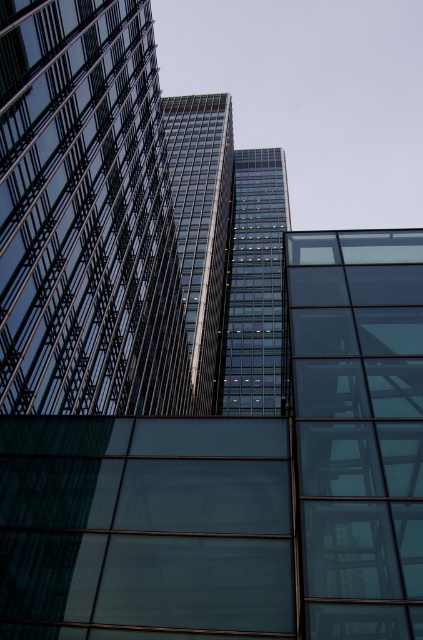
Between point (35, 349) and point (274, 170), which one is positioned in front?

Point (35, 349)

Does transparent glass building at center appear under glassy reflective tower at center?

Correct, transparent glass building at center is located below glassy reflective tower at center.

Does point (60, 168) come behind point (269, 301)?

That is False.

The height and width of the screenshot is (640, 423). Find the location of `transparent glass building at center`. transparent glass building at center is located at coordinates (85, 214).

Which is behind, point (257, 404) or point (175, 132)?

The point (175, 132) is more distant.

Is glassy reflective tower at center bigger than glassy steel tower at center?

Indeed, glassy reflective tower at center has a larger size compared to glassy steel tower at center.

Is point (242, 216) farther from viewer compared to point (203, 394)?

Yes, point (242, 216) is behind point (203, 394).

Locate an element on the screen. This screenshot has width=423, height=640. glassy reflective tower at center is located at coordinates (255, 288).

Is point (46, 12) positioned before point (205, 339)?

That is True.

Does transparent glass building at center have a greater height compared to glassy steel tower at center?

In fact, transparent glass building at center may be shorter than glassy steel tower at center.

Is point (18, 44) positioned in front of point (192, 221)?

Yes, point (18, 44) is closer to viewer.

Locate an element on the screen. transparent glass building at center is located at coordinates (85, 214).